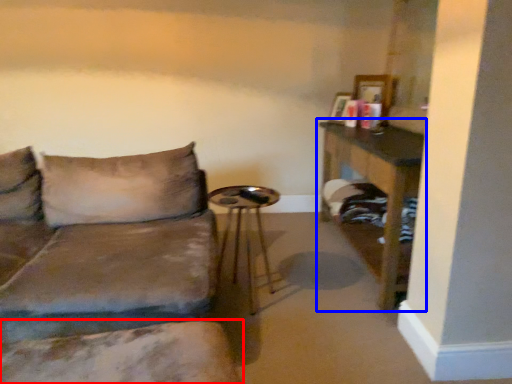
Question: Which object is closer to the camera taking this photo, swivel chair (highlighted by a red box) or table (highlighted by a blue box)?

Choices:
 (A) swivel chair
 (B) table

Answer: (A)